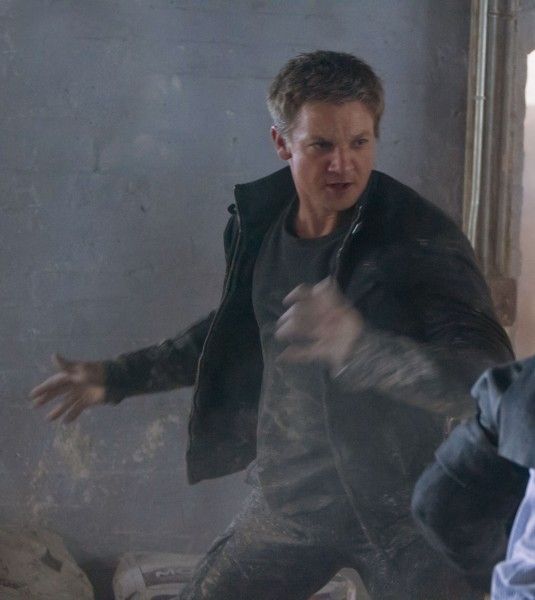
Where is `blue-gray painted wall`? blue-gray painted wall is located at coordinates (156, 73).